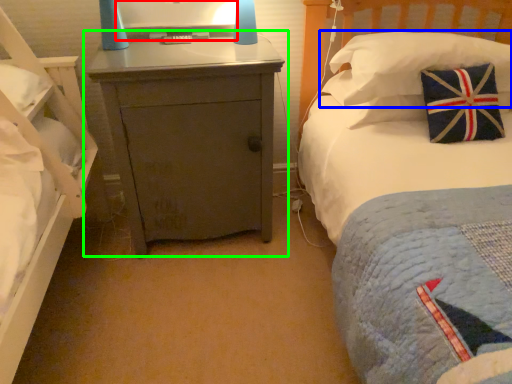
Question: Based on their relative distances, which object is nearer to computer monitor (highlighted by a red box)? Choose from pillow (highlighted by a blue box) and nightstand (highlighted by a green box).

Choices:
 (A) pillow
 (B) nightstand

Answer: (B)